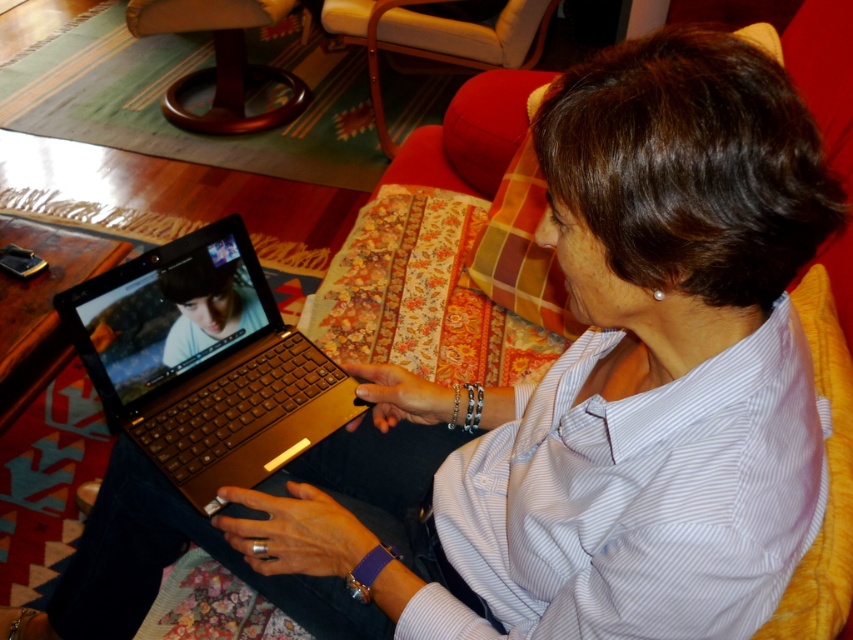
Does gold metallic laptop at center have a lesser height compared to red leather armchair at upper center?

Yes.

From the picture: Who is lower down, gold metallic laptop at center or red leather armchair at upper center?

Positioned lower is gold metallic laptop at center.

What do you see at coordinates (204, 362) in the screenshot? The height and width of the screenshot is (640, 853). I see `gold metallic laptop at center` at bounding box center [204, 362].

Identify the location of gold metallic laptop at center. The height and width of the screenshot is (640, 853). (204, 362).

The width and height of the screenshot is (853, 640). What do you see at coordinates (437, 38) in the screenshot?
I see `red leather armchair at upper center` at bounding box center [437, 38].

Find the location of a particular element. The width and height of the screenshot is (853, 640). red leather armchair at upper center is located at coordinates (437, 38).

The height and width of the screenshot is (640, 853). Find the location of `red leather armchair at upper center`. red leather armchair at upper center is located at coordinates (437, 38).

Does gold metallic laptop at center appear on the right side of mahogany wood armchair at upper left?

Indeed, gold metallic laptop at center is positioned on the right side of mahogany wood armchair at upper left.

You are a GUI agent. You are given a task and a screenshot of the screen. Output one action in this format:
    pyautogui.click(x=<x>, y=<y>)
    Task: Click on the gold metallic laptop at center
    This screenshot has width=853, height=640.
    Given the screenshot: What is the action you would take?
    pyautogui.click(x=204, y=362)

Is point (277, 413) positioned behind point (241, 3)?

No, it is in front of (241, 3).

The image size is (853, 640). What are the coordinates of `gold metallic laptop at center` in the screenshot? It's located at (204, 362).